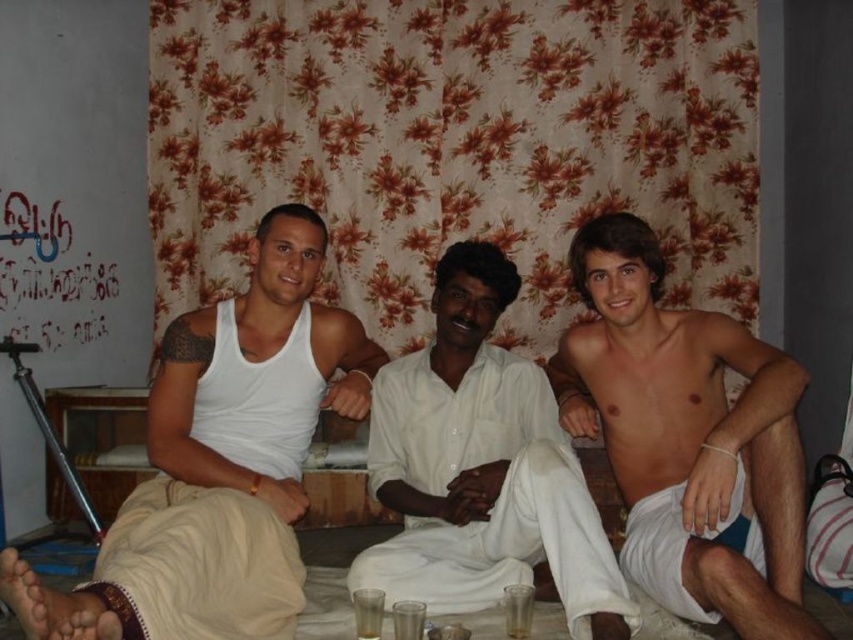
You are a tailor who needs to determine the appropriate fabric quantity for the white matte tank top at left and the shiny white shorts at right. Based on the image, which of these two garments requires more fabric?

The white matte tank top at left requires more fabric because it has a larger size compared to the shiny white shorts at right.